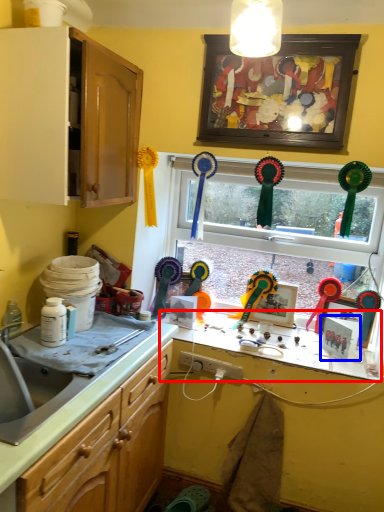
Question: Which of the following is the closest to the observer, counter top (highlighted by a red box) or picture frame (highlighted by a blue box)?

Choices:
 (A) counter top
 (B) picture frame

Answer: (A)